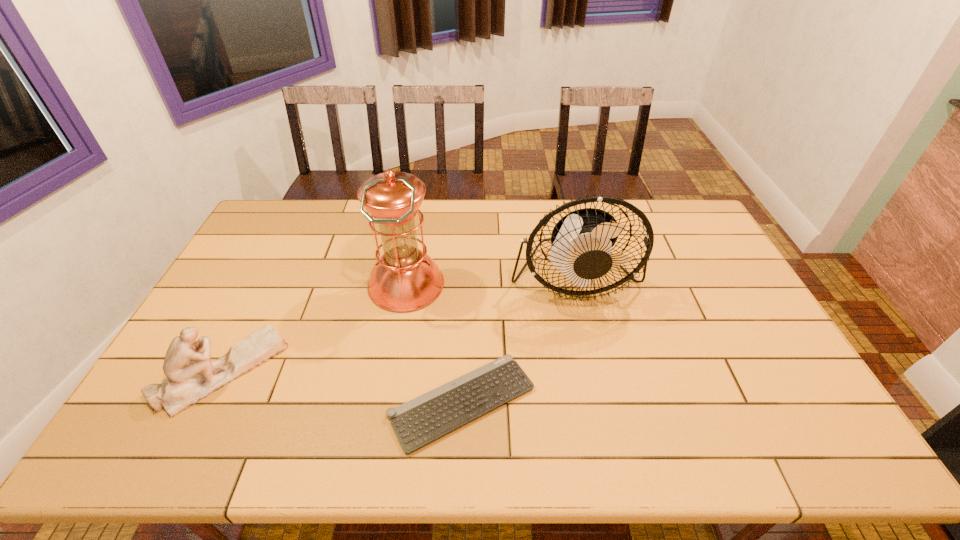
What are the coordinates of `blank space that satisfies the following two spatial constraints: 1. on the front-facing side of the leftmost object; 2. on the left side of the computer keyboard` in the screenshot? It's located at (207, 402).

Locate an element on the screen. free space that satisfies the following two spatial constraints: 1. in front of the fan, directing airflow; 2. on the front-facing side of the figurine is located at coordinates (595, 371).